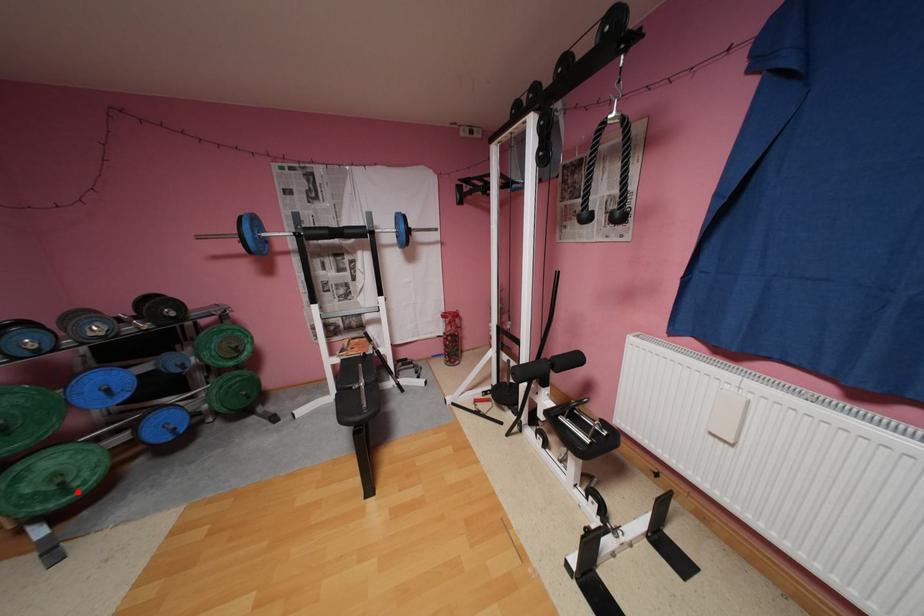
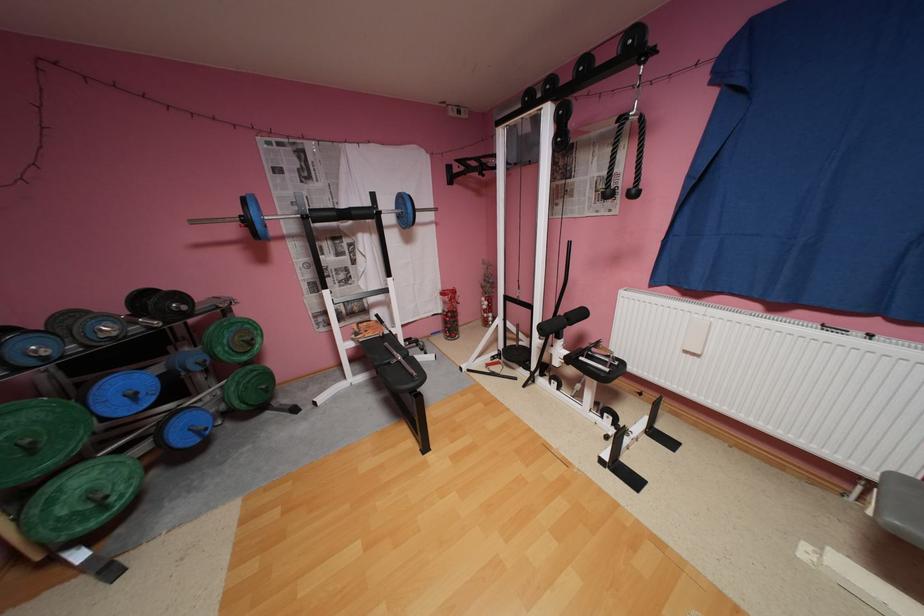
Locate, in the second image, the point that corresponds to the highlighted location in the first image.

(116, 508)